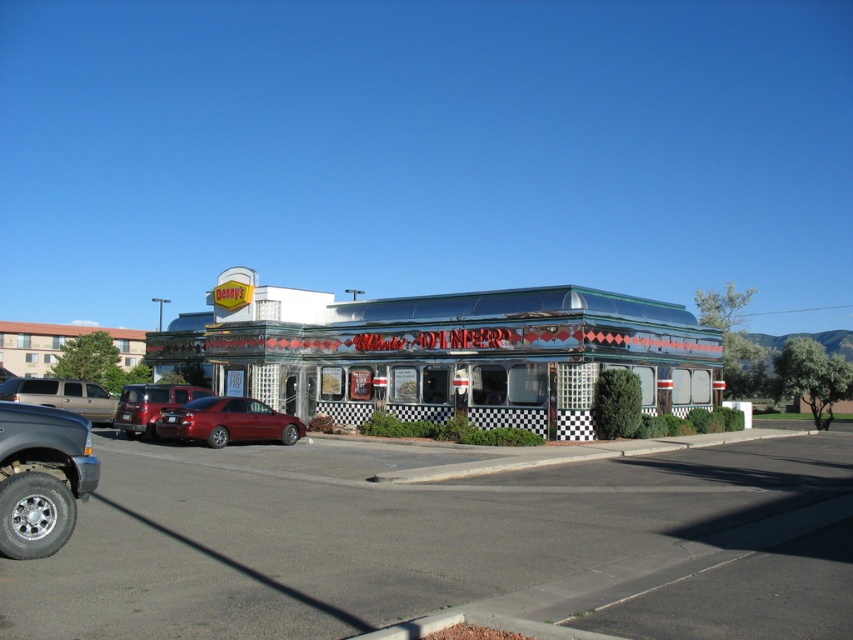
You are standing at the point marked by point (x=450, y=355) in the diner. Which direction should you walk to exit the diner and enter the parking lot?

Since the point (x=450, y=355) represents the metallic diner at center, you should walk towards the entrance facing the parking lot to exit.

You are a delivery person trying to park your van in the smooth asphalt parking lot at lower left. However, there is a glossy red sedan at center blocking the entrance. Can you drive into the parking lot without moving the sedan?

The smooth asphalt parking lot at lower left is positioned under the glossy red sedan at center, which means the sedan is directly above or in front of the parking lot entrance. Since the sedan is blocking the entrance, you cannot drive into the parking lot without moving the sedan.

You are standing in front of the diner and want to walk to both point (193, 528) and point (271, 419). Which point will you reach first?

You will reach point (193, 528) first because it is closer to you than point (271, 419).